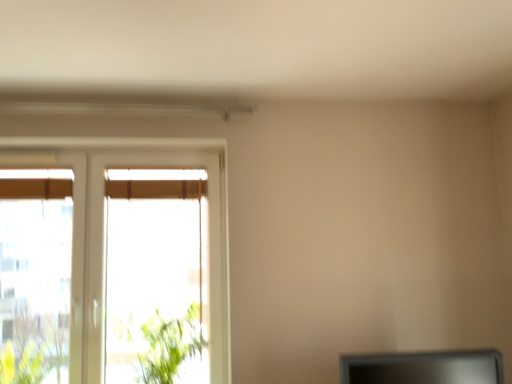
Question: Is white plastic window at left surrounded by matte black monitor at lower right?

Choices:
 (A) yes
 (B) no

Answer: (B)

Question: Is matte black monitor at lower right oriented towards white plastic window at left?

Choices:
 (A) yes
 (B) no

Answer: (B)

Question: From a real-world perspective, is matte black monitor at lower right located higher than white plastic window at left?

Choices:
 (A) no
 (B) yes

Answer: (A)

Question: Is matte black monitor at lower right wider than white plastic window at left?

Choices:
 (A) yes
 (B) no

Answer: (A)

Question: Is matte black monitor at lower right thinner than white plastic window at left?

Choices:
 (A) no
 (B) yes

Answer: (A)

Question: Relative to white plastic window at left, is matte black monitor at lower right in front or behind?

Choices:
 (A) behind
 (B) front

Answer: (B)

Question: Is matte black monitor at lower right inside or outside of white plastic window at left?

Choices:
 (A) outside
 (B) inside

Answer: (A)

Question: From the image's perspective, is matte black monitor at lower right located above or below white plastic window at left?

Choices:
 (A) above
 (B) below

Answer: (B)

Question: Is point (394, 364) closer or farther from the camera than point (72, 243)?

Choices:
 (A) farther
 (B) closer

Answer: (B)

Question: From a real-world perspective, is green leafy plant at left physically located above or below matte black monitor at lower right?

Choices:
 (A) above
 (B) below

Answer: (A)

Question: Is green leafy plant at left taller or shorter than matte black monitor at lower right?

Choices:
 (A) tall
 (B) short

Answer: (A)

Question: In terms of size, does green leafy plant at left appear bigger or smaller than matte black monitor at lower right?

Choices:
 (A) small
 (B) big

Answer: (B)

Question: Is point (139, 372) closer or farther from the camera than point (417, 379)?

Choices:
 (A) farther
 (B) closer

Answer: (A)

Question: Is point (125, 334) positioned closer to the camera than point (105, 158)?

Choices:
 (A) farther
 (B) closer

Answer: (B)

Question: From the image's perspective, is green leafy plant at left above or below white plastic window at left?

Choices:
 (A) below
 (B) above

Answer: (A)